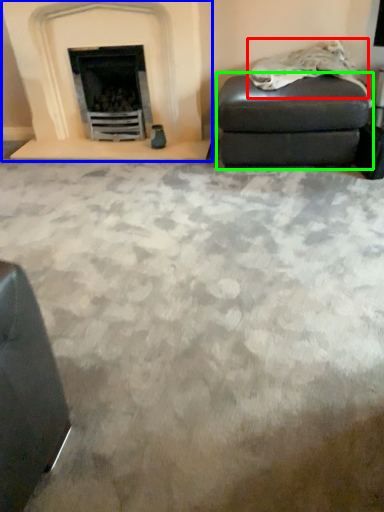
Question: Estimate the real-world distances between objects in this image. Which object is closer to material (highlighted by a red box), fireplace (highlighted by a blue box) or stool (highlighted by a green box)?

Choices:
 (A) fireplace
 (B) stool

Answer: (B)